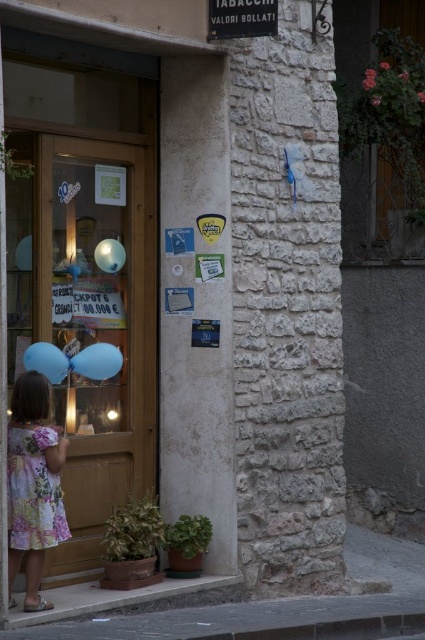
Between point (61, 513) and point (121, 266), which one is positioned behind?

Positioned behind is point (121, 266).

Who is more forward, (14, 545) or (113, 269)?

Point (14, 545) is more forward.

Is point (36, 493) closer to camera compared to point (104, 244)?

That is True.

Where is `floral cotton dress at lower left`? floral cotton dress at lower left is located at coordinates (34, 490).

Can you confirm if floral cotton dress at lower left is thinner than black metal sign at upper center?

Yes, floral cotton dress at lower left is thinner than black metal sign at upper center.

What do you see at coordinates (34, 490) in the screenshot?
I see `floral cotton dress at lower left` at bounding box center [34, 490].

Is point (62, 516) behind point (215, 33)?

No, it is in front of (215, 33).

The width and height of the screenshot is (425, 640). I want to click on floral cotton dress at lower left, so click(34, 490).

Measure the distance from light blue rubber balloon at left to matte blue balloon at left.

light blue rubber balloon at left is 8.11 inches away from matte blue balloon at left.

Is light blue rubber balloon at left above matte blue balloon at left?

No.

Is point (79, 365) positioned after point (47, 378)?

Yes, point (79, 365) is behind point (47, 378).

Locate an element on the screen. Image resolution: width=425 pixels, height=640 pixels. light blue rubber balloon at left is located at coordinates [96, 362].